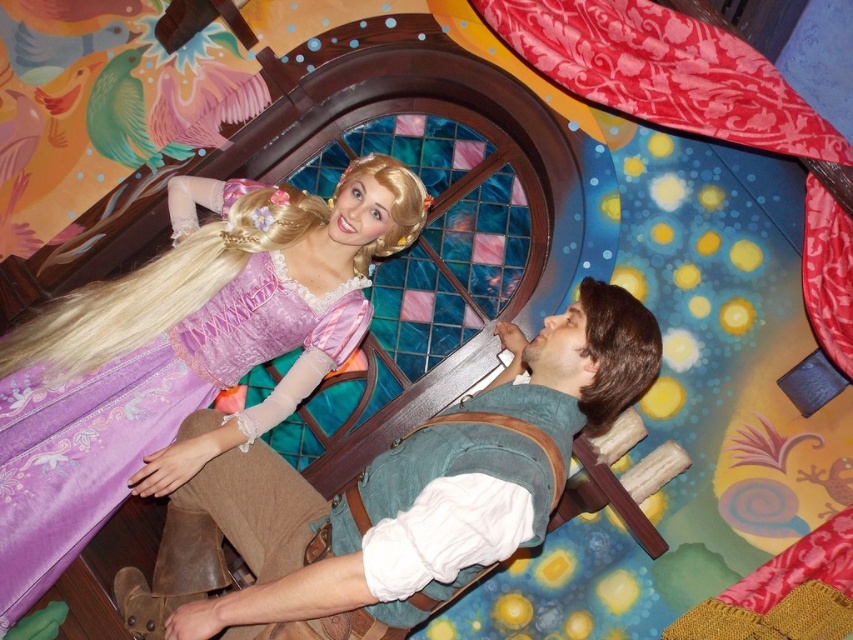
Between purple satin dress at upper left and matte green vest at center, which one appears on the right side from the viewer's perspective?

matte green vest at center is more to the right.

Consider the image. Does purple satin dress at upper left have a lesser height compared to matte green vest at center?

In fact, purple satin dress at upper left may be taller than matte green vest at center.

The width and height of the screenshot is (853, 640). What do you see at coordinates (181, 353) in the screenshot?
I see `purple satin dress at upper left` at bounding box center [181, 353].

Locate an element on the screen. purple satin dress at upper left is located at coordinates (181, 353).

Is purple satin dress at upper left smaller than red satin curtain at upper right?

No.

This screenshot has height=640, width=853. What do you see at coordinates (181, 353) in the screenshot?
I see `purple satin dress at upper left` at bounding box center [181, 353].

Which is behind, point (39, 349) or point (804, 300)?

Positioned behind is point (804, 300).

Where is `purple satin dress at upper left`? Image resolution: width=853 pixels, height=640 pixels. purple satin dress at upper left is located at coordinates (181, 353).

Is matte green vest at center taller than red satin curtain at upper right?

No.

In the scene shown: Between matte green vest at center and red satin curtain at upper right, which one is positioned higher?

red satin curtain at upper right is above.

Is point (405, 572) positioned in front of point (695, 29)?

Yes, point (405, 572) is in front of point (695, 29).

Identify the location of matte green vest at center. The width and height of the screenshot is (853, 640). (415, 492).